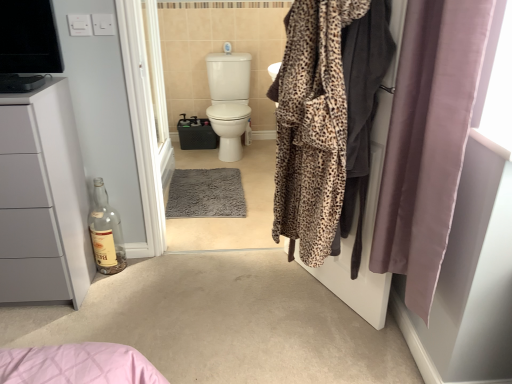
Question: Is leopard print robe at center, which is the second screen door from left to right, not close to clear glass bottle at lower left?

Choices:
 (A) yes
 (B) no

Answer: (A)

Question: Does leopard print robe at center, which is the second screen door from left to right, have a greater width compared to clear glass bottle at lower left?

Choices:
 (A) no
 (B) yes

Answer: (B)

Question: Is leopard print robe at center, the second screen door when ordered from back to front, to the left of clear glass bottle at lower left from the viewer's perspective?

Choices:
 (A) yes
 (B) no

Answer: (B)

Question: Is leopard print robe at center, which is the second screen door from left to right, aimed at clear glass bottle at lower left?

Choices:
 (A) yes
 (B) no

Answer: (B)

Question: From the image's perspective, would you say leopard print robe at center, the second screen door when ordered from back to front, is shown under clear glass bottle at lower left?

Choices:
 (A) yes
 (B) no

Answer: (B)

Question: Does leopard print robe at center, the first screen door in the right-to-left sequence, have a greater height compared to clear glass bottle at lower left?

Choices:
 (A) yes
 (B) no

Answer: (A)

Question: Considering the relative positions of white glossy screen door at center, marked as the 2th screen door in a right-to-left arrangement, and leopard print robe at center, the first screen door in the right-to-left sequence, in the image provided, is white glossy screen door at center, marked as the 2th screen door in a right-to-left arrangement, to the right of leopard print robe at center, the first screen door in the right-to-left sequence, from the viewer's perspective?

Choices:
 (A) yes
 (B) no

Answer: (B)

Question: Can you confirm if white glossy screen door at center, marked as the 2th screen door in a right-to-left arrangement, is wider than leopard print robe at center, which is the second screen door from left to right?

Choices:
 (A) yes
 (B) no

Answer: (B)

Question: Would you say white glossy screen door at center, marked as the 2th screen door in a right-to-left arrangement, is outside leopard print robe at center, the second screen door when ordered from back to front?

Choices:
 (A) no
 (B) yes

Answer: (B)

Question: Does white glossy screen door at center, acting as the 1th screen door starting from the left, contain leopard print robe at center, which is the second screen door from left to right?

Choices:
 (A) yes
 (B) no

Answer: (B)

Question: Is white glossy screen door at center, acting as the second screen door starting from the front, taller than leopard print robe at center, which is the second screen door from left to right?

Choices:
 (A) yes
 (B) no

Answer: (A)

Question: Is white glossy screen door at center, marked as the 2th screen door in a right-to-left arrangement, closer to the viewer compared to leopard print robe at center, the second screen door when ordered from back to front?

Choices:
 (A) yes
 (B) no

Answer: (B)

Question: Can you confirm if clear glass bottle at lower left is thinner than leopard print robe at right?

Choices:
 (A) no
 (B) yes

Answer: (A)